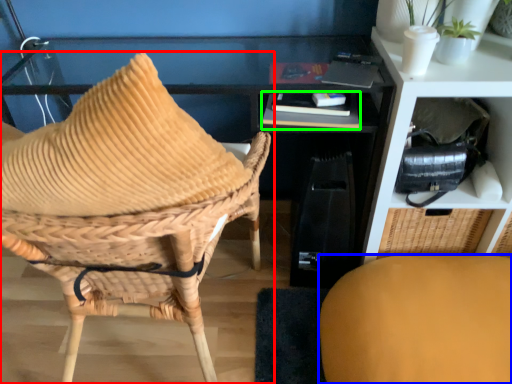
Question: Estimate the real-world distances between objects in this image. Which object is closer to chair (highlighted by a red box), chair (highlighted by a blue box) or book (highlighted by a green box)?

Choices:
 (A) chair
 (B) book

Answer: (B)